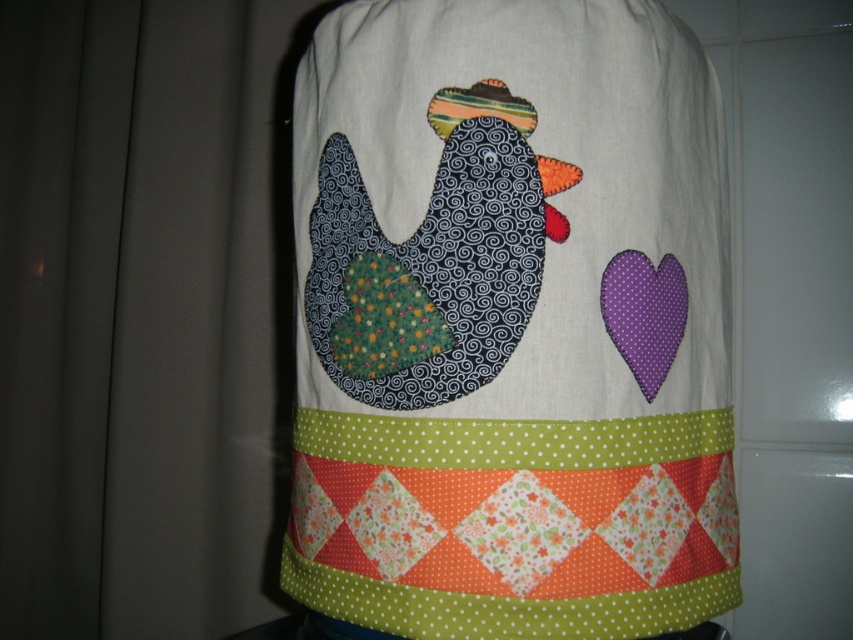
What do you see at coordinates (511, 323) in the screenshot? The height and width of the screenshot is (640, 853). I see `quilted fabric chicken at center` at bounding box center [511, 323].

Who is lower down, quilted fabric chicken at center or textured dark blue chicken at center?

Positioned lower is quilted fabric chicken at center.

Which is behind, point (737, 582) or point (527, 241)?

Point (737, 582)

What are the coordinates of `quilted fabric chicken at center` in the screenshot? It's located at (511, 323).